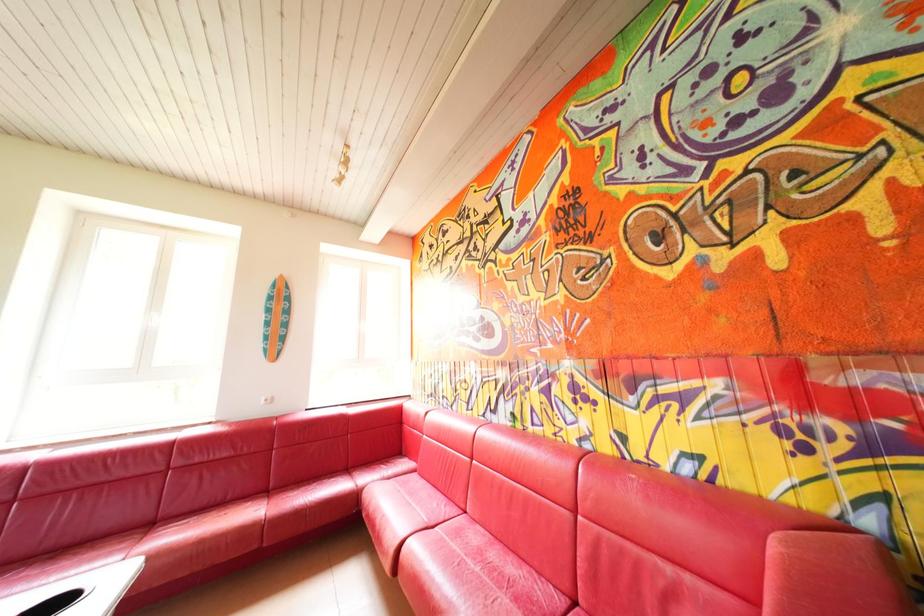
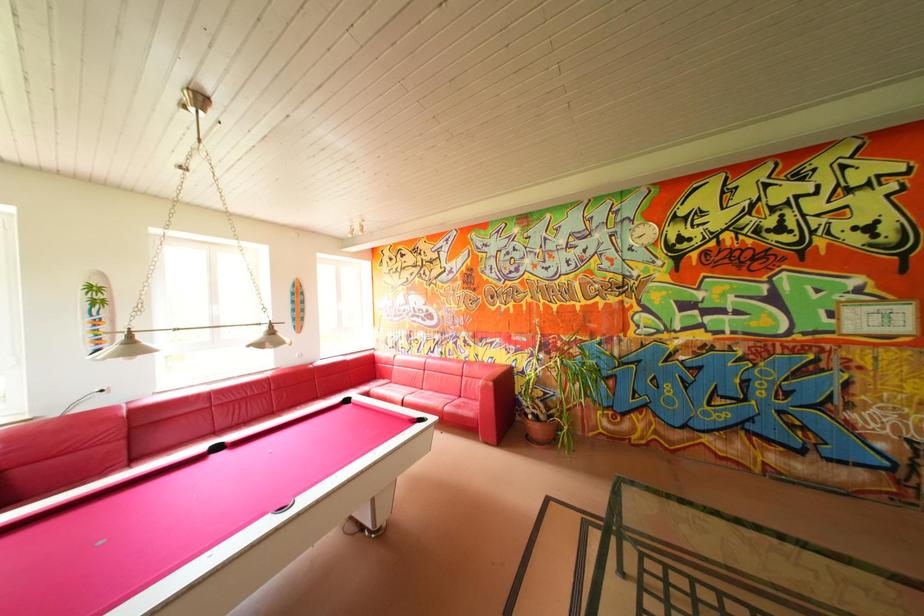
Which direction would the cameraman need to move to produce the second image?

The movement direction of the cameraman is left, backward.